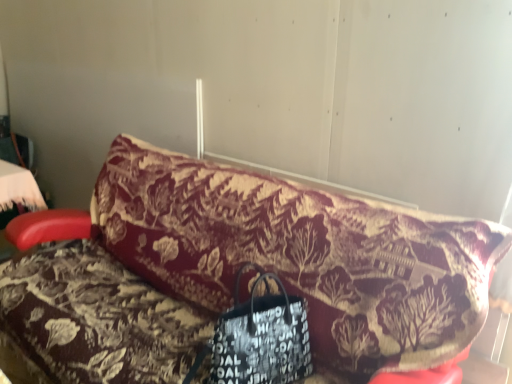
Question: Can you confirm if velvet floral-patterned couch at center is taller than black leather handbag at center?

Choices:
 (A) no
 (B) yes

Answer: (B)

Question: From the image's perspective, is velvet floral-patterned couch at center on top of black leather handbag at center?

Choices:
 (A) yes
 (B) no

Answer: (A)

Question: From a real-world perspective, is velvet floral-patterned couch at center located beneath black leather handbag at center?

Choices:
 (A) no
 (B) yes

Answer: (B)

Question: Is black leather handbag at center inside velvet floral-patterned couch at center?

Choices:
 (A) yes
 (B) no

Answer: (A)

Question: Is the depth of velvet floral-patterned couch at center greater than that of black leather handbag at center?

Choices:
 (A) no
 (B) yes

Answer: (A)

Question: Is velvet floral-patterned couch at center thinner than black leather handbag at center?

Choices:
 (A) no
 (B) yes

Answer: (A)

Question: From the image's perspective, does black leather handbag at center appear lower than velvet floral-patterned couch at center?

Choices:
 (A) yes
 (B) no

Answer: (A)

Question: Considering the relative sizes of black leather handbag at center and velvet floral-patterned couch at center in the image provided, is black leather handbag at center smaller than velvet floral-patterned couch at center?

Choices:
 (A) no
 (B) yes

Answer: (B)

Question: Would you consider black leather handbag at center to be distant from velvet floral-patterned couch at center?

Choices:
 (A) no
 (B) yes

Answer: (A)

Question: Is black leather handbag at center in front of velvet floral-patterned couch at center?

Choices:
 (A) yes
 (B) no

Answer: (B)

Question: Is black leather handbag at center positioned behind velvet floral-patterned couch at center?

Choices:
 (A) no
 (B) yes

Answer: (B)

Question: From the image's perspective, does black leather handbag at center appear higher than velvet floral-patterned couch at center?

Choices:
 (A) no
 (B) yes

Answer: (A)

Question: Is velvet floral-patterned couch at center to the left or to the right of black leather handbag at center in the image?

Choices:
 (A) right
 (B) left

Answer: (B)